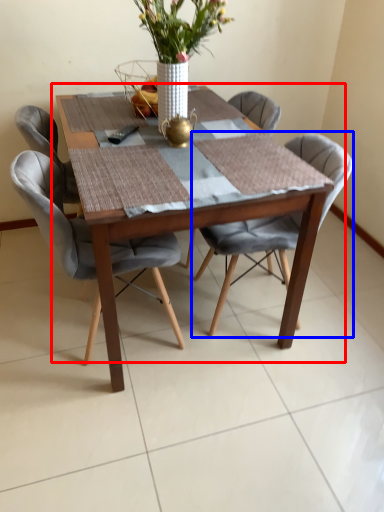
Question: Which object is closer to the camera taking this photo, kitchen & dining room table (highlighted by a red box) or chair (highlighted by a blue box)?

Choices:
 (A) kitchen & dining room table
 (B) chair

Answer: (A)